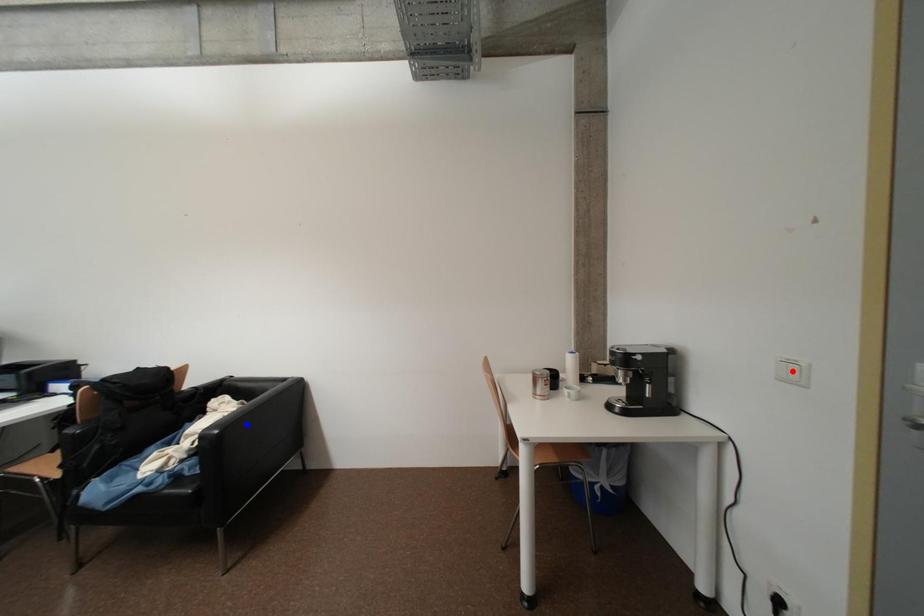
Question: Which of the two points in the image is closer to the camera?

Choices:
 (A) Blue point is closer.
 (B) Red point is closer.

Answer: (B)